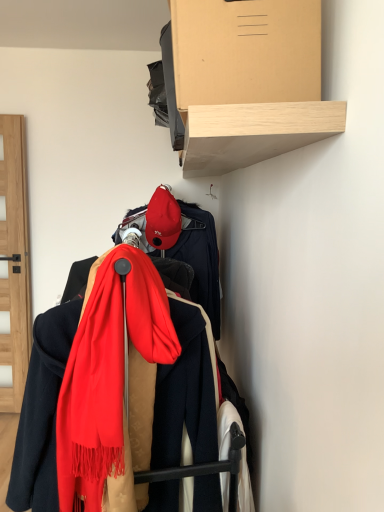
Question: In terms of height, does red soft scarf at center look taller or shorter compared to light brown wooden shelf at upper center?

Choices:
 (A) tall
 (B) short

Answer: (A)

Question: Is point (66, 466) closer or farther from the camera than point (238, 76)?

Choices:
 (A) closer
 (B) farther

Answer: (B)

Question: Which is farther from the matte red cap at center?

Choices:
 (A) light brown wooden shelf at upper center
 (B) red soft scarf at center

Answer: (B)

Question: Which is nearer to the matte red cap at center?

Choices:
 (A) light brown wooden shelf at upper center
 (B) red soft scarf at center

Answer: (A)